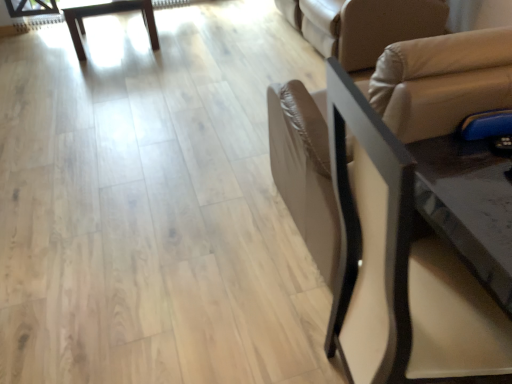
The width and height of the screenshot is (512, 384). What are the coordinates of `vacant space to the left of black leather chair at right` in the screenshot? It's located at (254, 339).